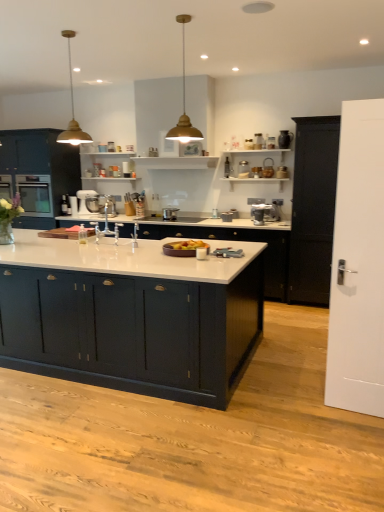
Find the location of `unoccupied area in front of white glossy sink at center`. unoccupied area in front of white glossy sink at center is located at coordinates (105, 248).